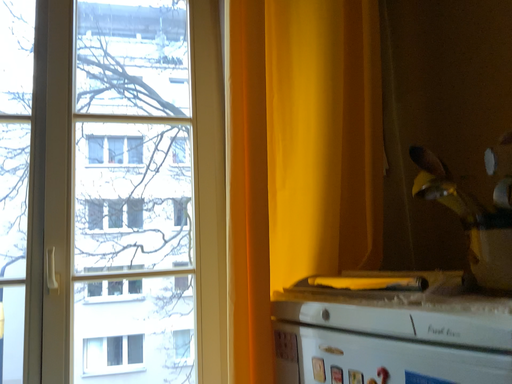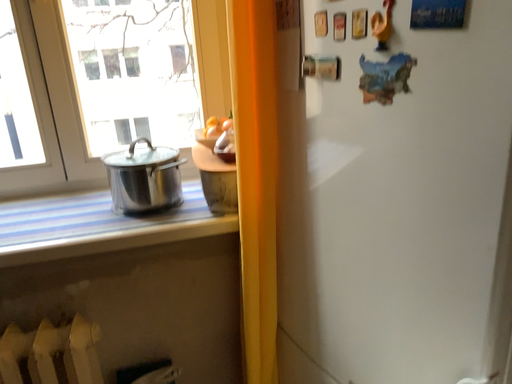
Question: Which way did the camera rotate in the video?

Choices:
 (A) rotated upward
 (B) rotated downward

Answer: (B)